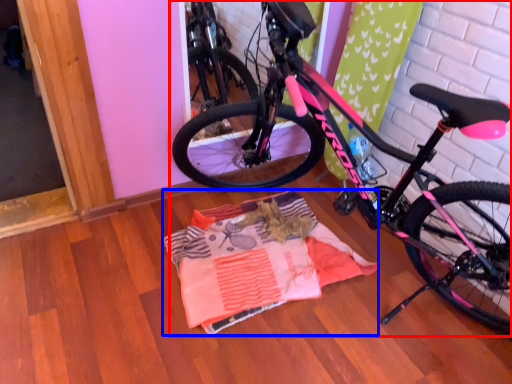
Question: Which object is closer to the camera taking this photo, bicycle (highlighted by a red box) or blanket (highlighted by a blue box)?

Choices:
 (A) bicycle
 (B) blanket

Answer: (A)